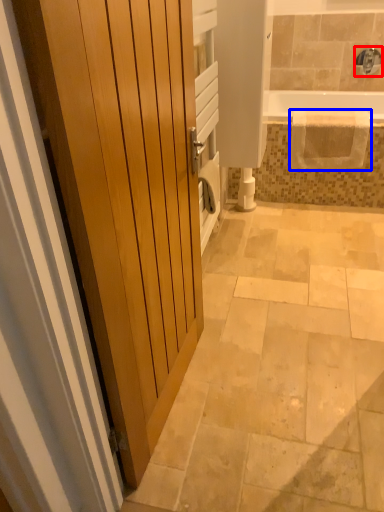
Question: Which of the following is the farthest to the observer, faucet (highlighted by a red box) or blanket (highlighted by a blue box)?

Choices:
 (A) faucet
 (B) blanket

Answer: (A)